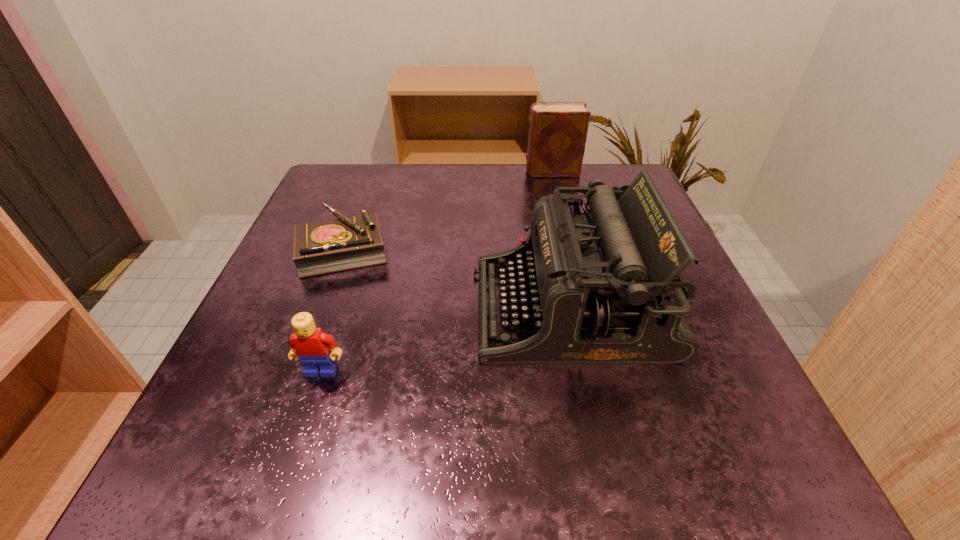
This screenshot has height=540, width=960. In order to click on typewriter in this screenshot , I will do `click(605, 286)`.

Locate an element on the screen. The image size is (960, 540). the farther diary is located at coordinates (557, 135).

Identify the location of the taller diary. (557, 135).

You are a GUI agent. You are given a task and a screenshot of the screen. Output one action in this format:
    pyautogui.click(x=<x>, y=<y>)
    Task: Click on the second shortest object
    Image resolution: width=960 pixels, height=540 pixels.
    Given the screenshot: What is the action you would take?
    pyautogui.click(x=310, y=344)

Locate an element on the screen. The height and width of the screenshot is (540, 960). the shorter diary is located at coordinates (346, 243).

Where is `the shortest object`? Image resolution: width=960 pixels, height=540 pixels. the shortest object is located at coordinates (346, 243).

At what (x,y) coordinates should I click in order to perform the action: click on vacant space located 0.290m on the keyboard of the typewriter. Please return your answer as a coordinate pair (x, y). Looking at the image, I should click on (300, 309).

This screenshot has width=960, height=540. I want to click on free space located 0.080m on the keyboard of the typewriter, so click(425, 309).

Image resolution: width=960 pixels, height=540 pixels. I want to click on free location located on the keyboard of the typewriter, so click(x=425, y=309).

You are a GUI agent. You are given a task and a screenshot of the screen. Output one action in this format:
    pyautogui.click(x=<x>, y=<y>)
    Task: Click on the vacant space located 0.280m on the spine side of the farthest object
    Image resolution: width=960 pixels, height=540 pixels.
    Given the screenshot: What is the action you would take?
    pyautogui.click(x=412, y=171)